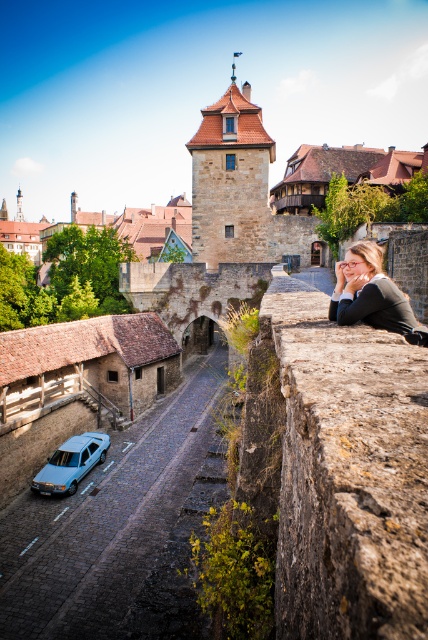
Which is behind, point (362, 269) or point (56, 456)?

The point (56, 456) is behind.

Can you confirm if matte black sweater at center is wider than light blue matte sedan at lower left?

Yes, matte black sweater at center is wider than light blue matte sedan at lower left.

This screenshot has height=640, width=428. What do you see at coordinates (371, 294) in the screenshot?
I see `matte black sweater at center` at bounding box center [371, 294].

Locate an element on the screen. This screenshot has height=640, width=428. matte black sweater at center is located at coordinates (371, 294).

Can you confirm if rusty stone ledge at right is positioned below light blue matte sedan at lower left?

Actually, rusty stone ledge at right is above light blue matte sedan at lower left.

Is point (323, 388) farther from camera compared to point (104, 458)?

No, (323, 388) is closer to viewer.

Is point (389, 467) farther from viewer compared to point (68, 486)?

No.

Find the location of a particular element. The image size is (428, 640). rusty stone ledge at right is located at coordinates (347, 472).

Does point (397, 531) come in front of point (338, 282)?

Yes, point (397, 531) is closer to viewer.

Is rusty stone ledge at right shorter than matte black sweater at center?

No.

Is point (371, 481) more distant than point (389, 323)?

That is False.

Where is `rusty stone ledge at right`? This screenshot has height=640, width=428. rusty stone ledge at right is located at coordinates (347, 472).